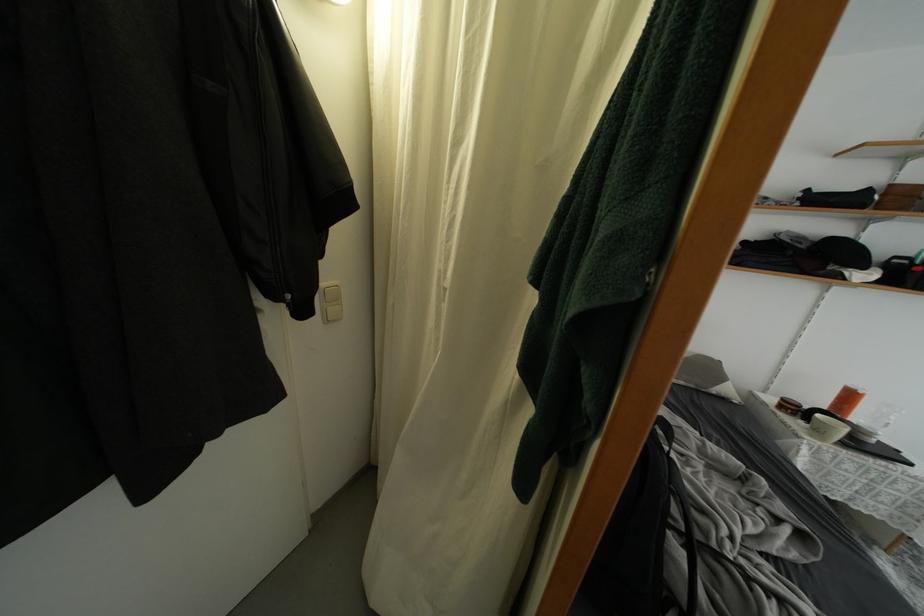
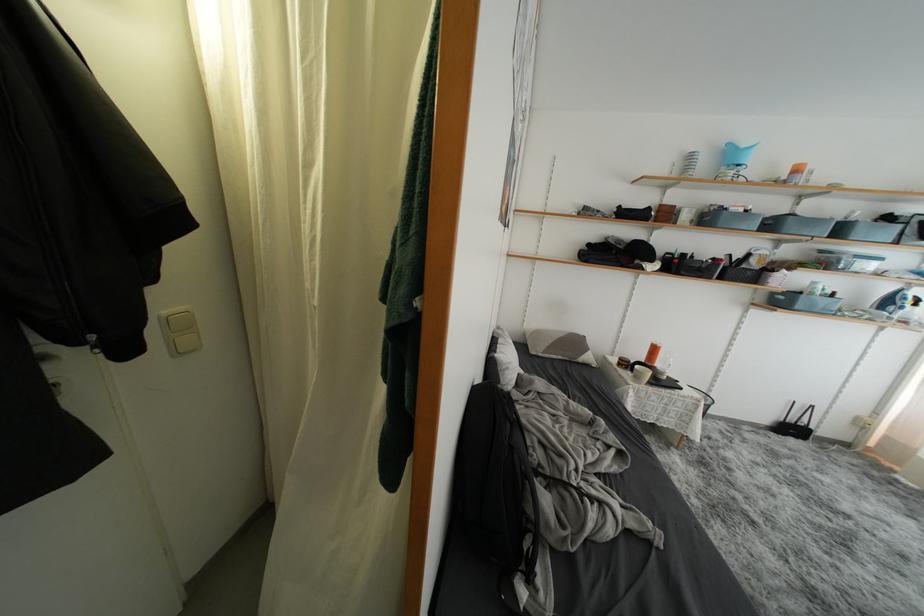
Which direction would the cameraman need to move to produce the second image?

The cameraman moved toward right, backward.